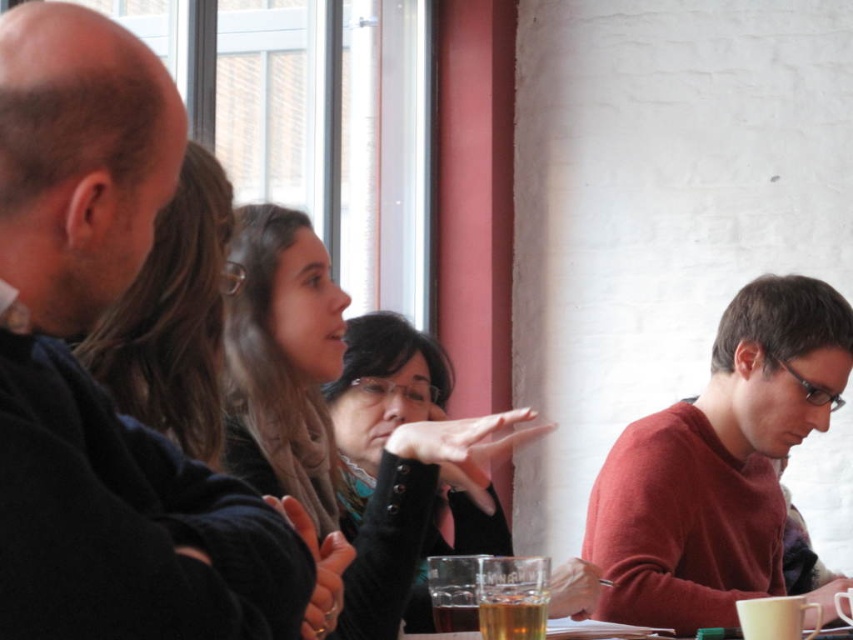
You are a new attendee arriving at the meeting and need to sit down. There are two notable features at the table you can see from your entrance point. The first is a person wearing a matte red sweater at right, and the second is a person with matte black hair at upper left. Based on their positions, which of these two features should you approach if you want to sit to the left side of the table?

The matte black hair at upper left is located at the upper left position, so approaching it would place you to the left side of the table.

You are a photographer trying to capture a candid shot of the group. You notice the matte red sweater at right and the matte black hair at upper left. Which object should you focus on to ensure it appears larger in your photo?

The matte red sweater at right has a greater height compared to the matte black hair at upper left, so focusing on it will result in a larger appearance in the photo.

You are part of the group sitting around the table in the image. You need to pass a note to the person wearing the matte red sweater at right. Since you are currently sitting next to the smooth black shirt at left, which direction should you pass the note?

The smooth black shirt at left is positioned on the left side of matte red sweater at right, so you should pass the note to your right.